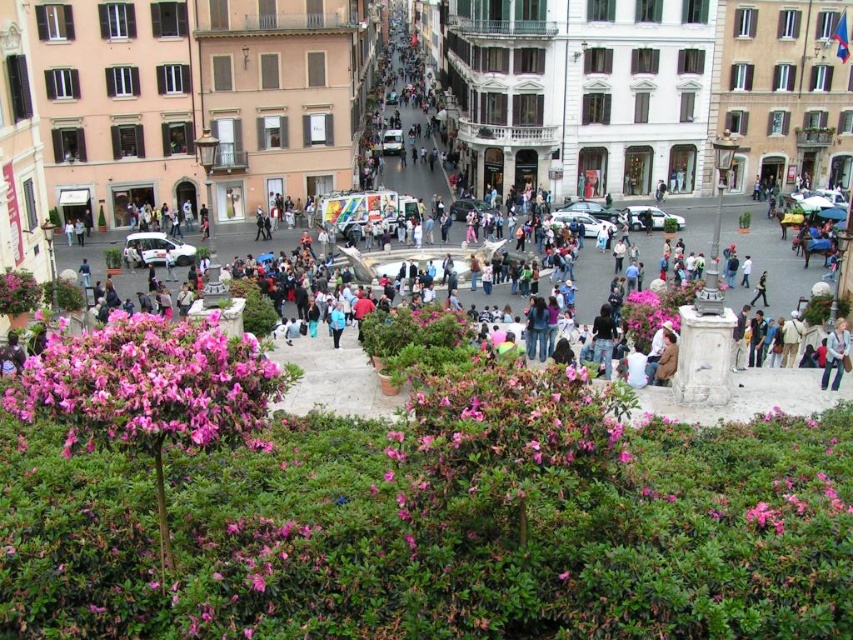
Who is shorter, pink glossy bush at lower left or blue denim jeans at lower right?

blue denim jeans at lower right is shorter.

Which is in front, point (151, 332) or point (837, 333)?

Point (151, 332) is more forward.

Identify the location of pink glossy bush at lower left. Image resolution: width=853 pixels, height=640 pixels. (149, 385).